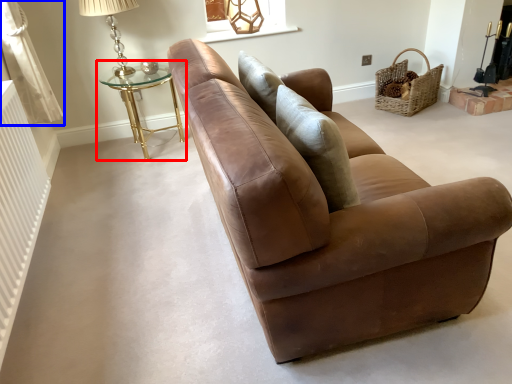
Question: Which object appears farthest to the camera in this image, table (highlighted by a red box) or curtain (highlighted by a blue box)?

Choices:
 (A) table
 (B) curtain

Answer: (A)